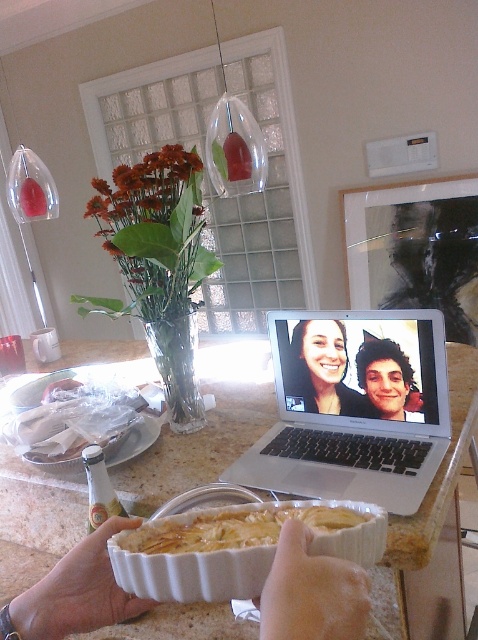
You are setting up a video call in the kitchen. You have a silver metallic laptop at center and a camera. How far apart should you place them to ensure optimal video quality?

The silver metallic laptop at center and camera should be placed 34.37 inches apart from each other for optimal video quality.

You are a chef holding a white ceramic dish at center and noticing your matte black hair at center. Which object is taller when comparing their heights?

The matte black hair at center is taller than the white ceramic dish at center.